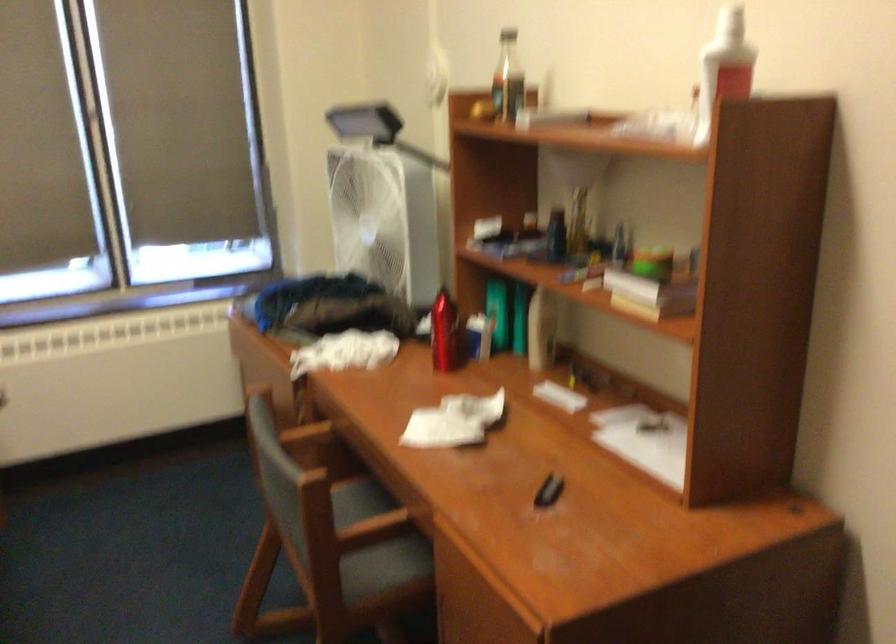
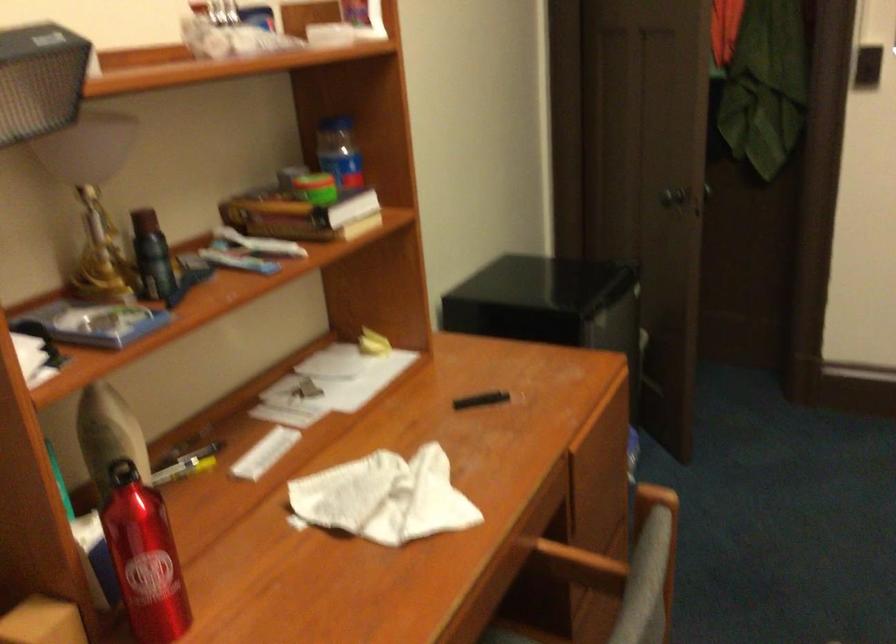
The point at [445,406] is marked in the first image. Where is the corresponding point in the second image?

(383, 498)